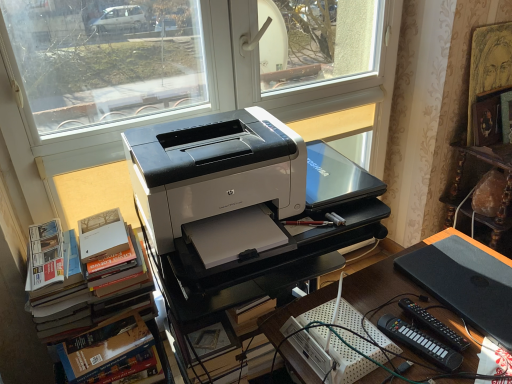
Find the location of `vacant space behind black plastic remote control at lower right, acting as the 1th equipment starting from the left`. vacant space behind black plastic remote control at lower right, acting as the 1th equipment starting from the left is located at coordinates (388, 296).